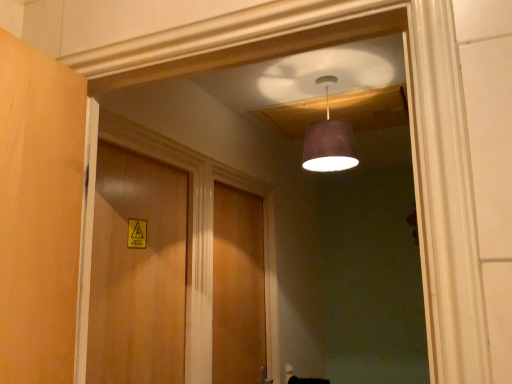
What do you see at coordinates (137, 271) in the screenshot?
I see `wooden door at center, the first door from the left` at bounding box center [137, 271].

Identify the location of matte purple lampshade at upper center. Image resolution: width=512 pixels, height=384 pixels. (329, 140).

The height and width of the screenshot is (384, 512). What are the coordinates of `wooden door at center, the 1th door viewed from the right` in the screenshot? It's located at (238, 288).

Which of these two, wooden door at center, the 2th door from the back, or matte purple lampshade at upper center, stands taller?

With more height is wooden door at center, the 2th door from the back.

Locate an element on the screen. the 1st door below the matte purple lampshade at upper center (from a real-world perspective) is located at coordinates (137, 271).

From a real-world perspective, between wooden door at center, the 2th door from the back, and matte purple lampshade at upper center, who is vertically lower?

wooden door at center, the 2th door from the back.

How distant is wooden door at center, the 2th door in the right-to-left sequence, from wooden door at center, the 2th door in the front-to-back sequence?

The distance of wooden door at center, the 2th door in the right-to-left sequence, from wooden door at center, the 2th door in the front-to-back sequence, is 54.04 centimeters.

Can you confirm if wooden door at center, the 2th door in the right-to-left sequence, is taller than wooden door at center, acting as the 1th door starting from the back?

Incorrect, the height of wooden door at center, the 2th door in the right-to-left sequence, is not larger of that of wooden door at center, acting as the 1th door starting from the back.

Would you say wooden door at center, which is the 1th door in front-to-back order, is to the left or to the right of wooden door at center, the 1th door viewed from the right, in the picture?

wooden door at center, which is the 1th door in front-to-back order, is positioned on wooden door at center, the 1th door viewed from the right,'s left side.

Is matte purple lampshade at upper center looking in the opposite direction of wooden door at center, acting as the 1th door starting from the back?

No.

Considering the relative positions of matte purple lampshade at upper center and wooden door at center, which appears as the second door when viewed from the left, in the image provided, is matte purple lampshade at upper center to the right of wooden door at center, which appears as the second door when viewed from the left, from the viewer's perspective?

Yes.

Considering the relative sizes of matte purple lampshade at upper center and wooden door at center, the 2th door in the front-to-back sequence, in the image provided, is matte purple lampshade at upper center smaller than wooden door at center, the 2th door in the front-to-back sequence,?

Yes, matte purple lampshade at upper center is smaller than wooden door at center, the 2th door in the front-to-back sequence.

From a real-world perspective, which is physically above, matte purple lampshade at upper center or wooden door at center, which appears as the second door when viewed from the left?

matte purple lampshade at upper center, from a real-world perspective.

What's the angular difference between wooden door at center, the 1th door viewed from the right, and matte purple lampshade at upper center's facing directions?

They differ by 92.8 degrees in their facing directions.

Which is in front, wooden door at center, the 2th door in the front-to-back sequence, or matte purple lampshade at upper center?

matte purple lampshade at upper center is more forward.

In the scene shown: Is wooden door at center, which appears as the second door when viewed from the left, in contact with matte purple lampshade at upper center?

There is a gap between wooden door at center, which appears as the second door when viewed from the left, and matte purple lampshade at upper center.

Is point (342, 120) positioned behind point (127, 375)?

Yes.

From a real-world perspective, is matte purple lampshade at upper center physically above wooden door at center, the first door from the left?

Yes, from a real-world perspective, matte purple lampshade at upper center is on top of wooden door at center, the first door from the left.

Does matte purple lampshade at upper center come in front of wooden door at center, the 2th door in the right-to-left sequence?

No, matte purple lampshade at upper center is further to the viewer.

Which object is wider, matte purple lampshade at upper center or wooden door at center, the 2th door from the back?

matte purple lampshade at upper center is wider.

Which object is positioned more to the right, wooden door at center, which appears as the second door when viewed from the left, or wooden door at center, which is the 1th door in front-to-back order?

From the viewer's perspective, wooden door at center, which appears as the second door when viewed from the left, appears more on the right side.

Where is `door located above the wooden door at center, the 2th door in the front-to-back sequence (from the image's perspective)`? This screenshot has height=384, width=512. door located above the wooden door at center, the 2th door in the front-to-back sequence (from the image's perspective) is located at coordinates (137, 271).

Is wooden door at center, the 1th door viewed from the right, oriented away from wooden door at center, which is the 1th door in front-to-back order?

No, wooden door at center, the 1th door viewed from the right, is not facing the opposite direction of wooden door at center, which is the 1th door in front-to-back order.

I want to click on light fixture above the wooden door at center, the 2th door from the back (from a real-world perspective), so click(329, 140).

You are a GUI agent. You are given a task and a screenshot of the screen. Output one action in this format:
    pyautogui.click(x=<x>, y=<y>)
    Task: Click on the door on the left of wooden door at center, acting as the 1th door starting from the back
    Image resolution: width=512 pixels, height=384 pixels.
    Given the screenshot: What is the action you would take?
    pyautogui.click(x=137, y=271)

Based on their spatial positions, is wooden door at center, acting as the 1th door starting from the back, or wooden door at center, the first door from the left, closer to matte purple lampshade at upper center?

wooden door at center, the first door from the left, is closer to matte purple lampshade at upper center.

Looking at the image, which one is located closer to wooden door at center, the 2th door in the front-to-back sequence, matte purple lampshade at upper center or wooden door at center, the 2th door in the right-to-left sequence?

wooden door at center, the 2th door in the right-to-left sequence, is positioned closer to the anchor wooden door at center, the 2th door in the front-to-back sequence.

From the picture: Which object lies nearer to the anchor point wooden door at center, the 2th door from the back, matte purple lampshade at upper center or wooden door at center, which appears as the second door when viewed from the left?

wooden door at center, which appears as the second door when viewed from the left, is positioned closer to the anchor wooden door at center, the 2th door from the back.

Considering their positions, is wooden door at center, which appears as the second door when viewed from the left, positioned further to wooden door at center, the 2th door from the back, than matte purple lampshade at upper center?

The object further to wooden door at center, the 2th door from the back, is matte purple lampshade at upper center.

Estimate the real-world distances between objects in this image. Which object is closer to wooden door at center, which appears as the second door when viewed from the left, wooden door at center, the 2th door from the back, or matte purple lampshade at upper center?

wooden door at center, the 2th door from the back, lies closer to wooden door at center, which appears as the second door when viewed from the left, than the other object.

When comparing their distances from matte purple lampshade at upper center, does wooden door at center, the first door from the left, or wooden door at center, which appears as the second door when viewed from the left, seem further?

wooden door at center, which appears as the second door when viewed from the left, lies further to matte purple lampshade at upper center than the other object.

Where is `door that lies between matte purple lampshade at upper center and wooden door at center, the 2th door in the front-to-back sequence, from top to bottom`? Image resolution: width=512 pixels, height=384 pixels. door that lies between matte purple lampshade at upper center and wooden door at center, the 2th door in the front-to-back sequence, from top to bottom is located at coordinates (137, 271).